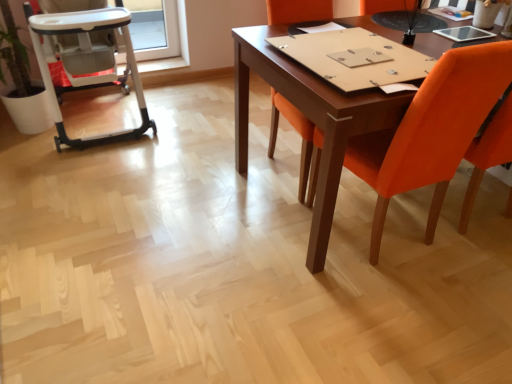
What are the coordinates of `free spot in front of orange fabric chair at right, which ranks as the 1th chair in right-to-left order` in the screenshot? It's located at (401, 314).